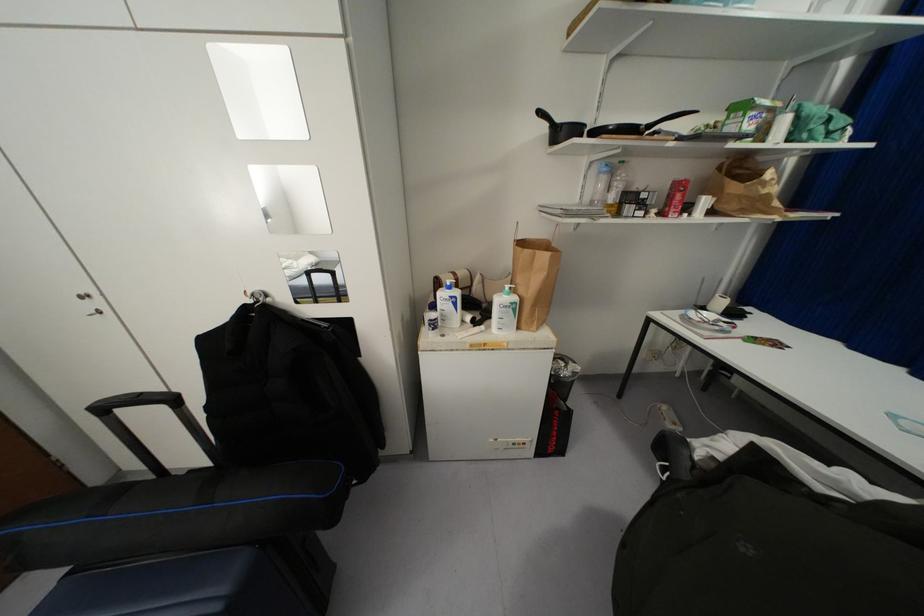
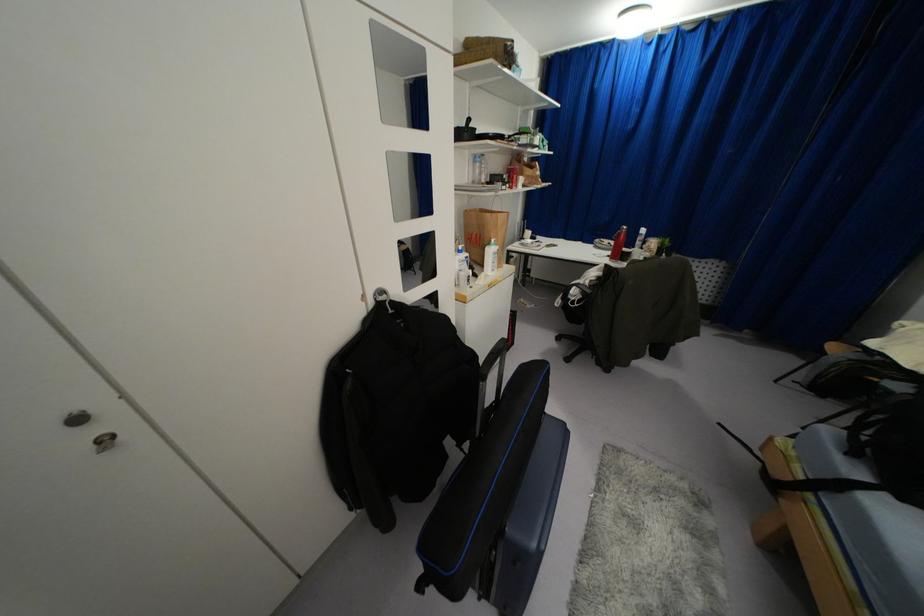
Locate, in the second image, the point that corresponds to (598,172) in the first image.

(475, 161)